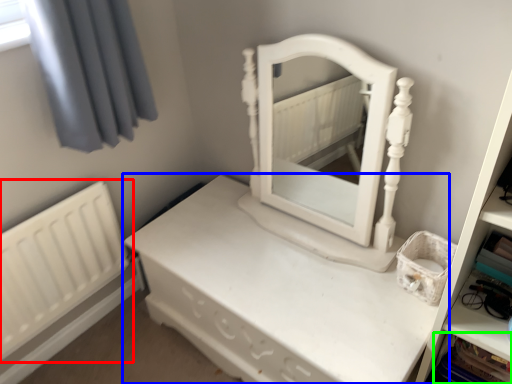
Question: Estimate the real-world distances between objects in this image. Which object is farther from radiator (highlighted by a red box), nightstand (highlighted by a blue box) or cabinet (highlighted by a green box)?

Choices:
 (A) nightstand
 (B) cabinet

Answer: (B)